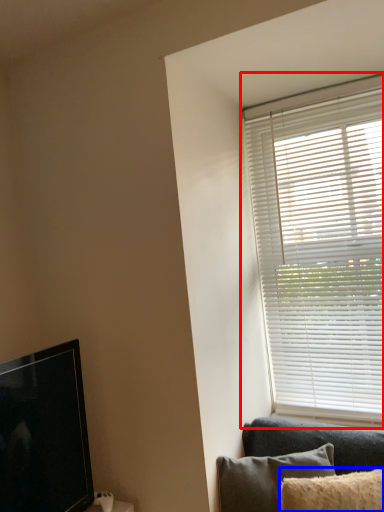
Question: Which object appears farthest to the camera in this image, window blind (highlighted by a red box) or pillow (highlighted by a blue box)?

Choices:
 (A) window blind
 (B) pillow

Answer: (A)